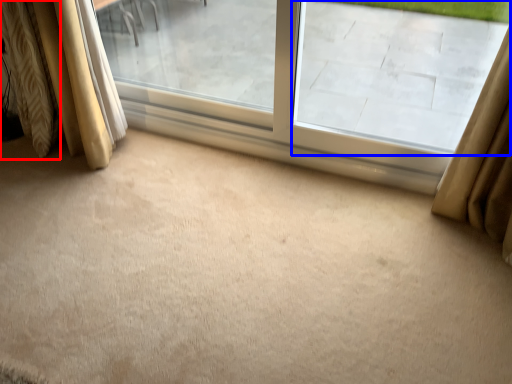
Question: Which object is closer to the camera taking this photo, curtain (highlighted by a red box) or window screen (highlighted by a blue box)?

Choices:
 (A) curtain
 (B) window screen

Answer: (B)